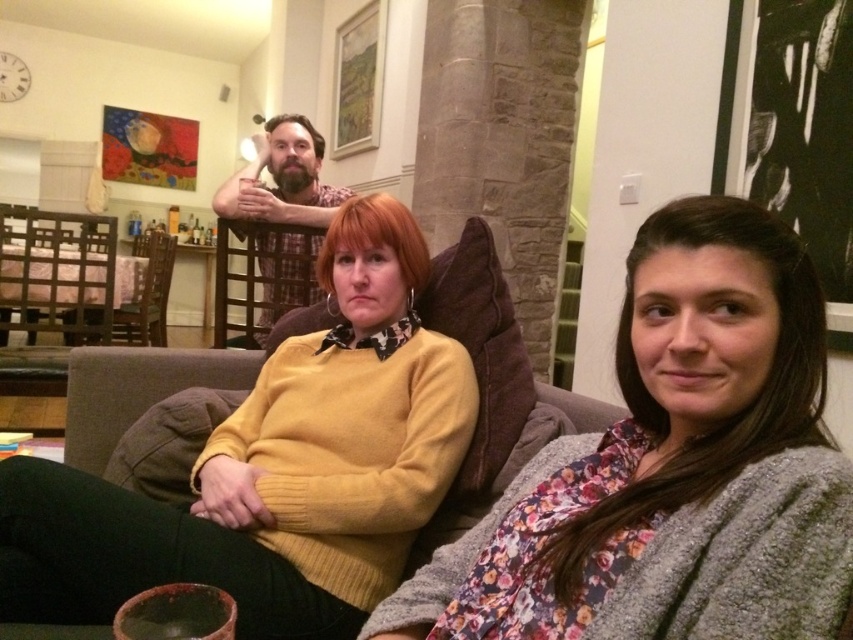
You are a GUI agent. You are given a task and a screenshot of the screen. Output one action in this format:
    pyautogui.click(x=<x>, y=<y>)
    Task: Click on the bearded man at upper center
    The image size is (853, 640).
    Given the screenshot: What is the action you would take?
    pyautogui.click(x=282, y=179)

Is bearded man at upper center bigger than woodenchair at left?

No, bearded man at upper center is not bigger than woodenchair at left.

You are a GUI agent. You are given a task and a screenshot of the screen. Output one action in this format:
    pyautogui.click(x=<x>, y=<y>)
    Task: Click on the bearded man at upper center
    The height and width of the screenshot is (640, 853).
    Given the screenshot: What is the action you would take?
    pyautogui.click(x=282, y=179)

Can you confirm if floral fabric sweater at center is bigger than woodenchair at left?

Incorrect, floral fabric sweater at center is not larger than woodenchair at left.

Who is positioned more to the left, floral fabric sweater at center or woodenchair at left?

woodenchair at left is more to the left.

The image size is (853, 640). Describe the element at coordinates (672, 467) in the screenshot. I see `floral fabric sweater at center` at that location.

Where is `floral fabric sweater at center`? This screenshot has width=853, height=640. floral fabric sweater at center is located at coordinates (672, 467).

Who is positioned more to the left, yellow knit sweater at center or bearded man at upper center?

From the viewer's perspective, bearded man at upper center appears more on the left side.

Between yellow knit sweater at center and bearded man at upper center, which one has less height?

yellow knit sweater at center

Where is `yellow knit sweater at center`? Image resolution: width=853 pixels, height=640 pixels. yellow knit sweater at center is located at coordinates (274, 468).